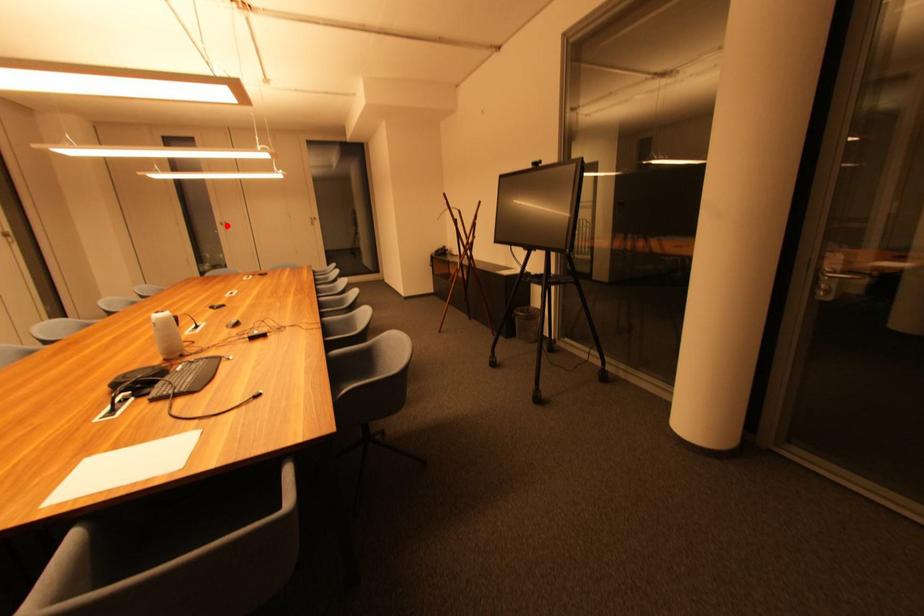
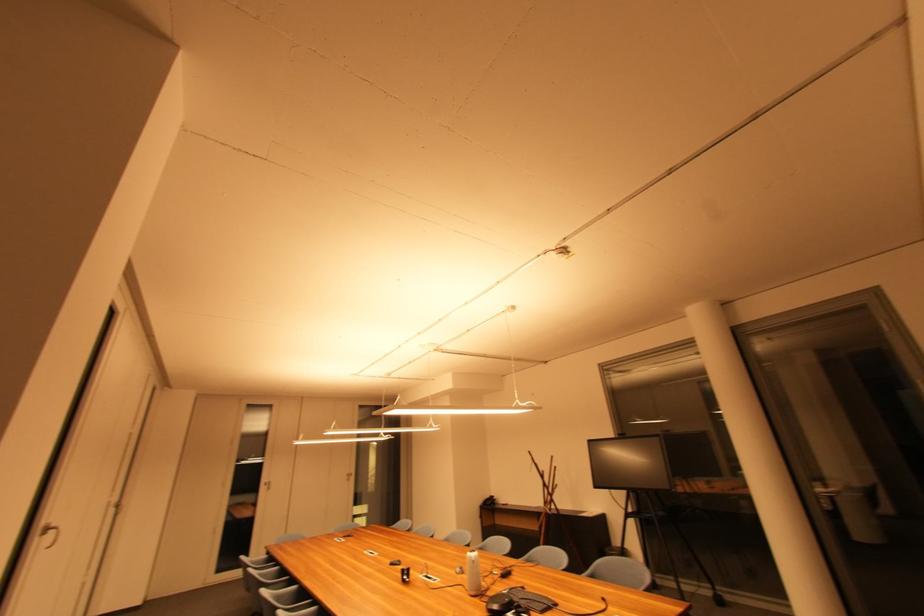
Find the pixel in the second image that matches the highlighted location in the first image.

(271, 485)